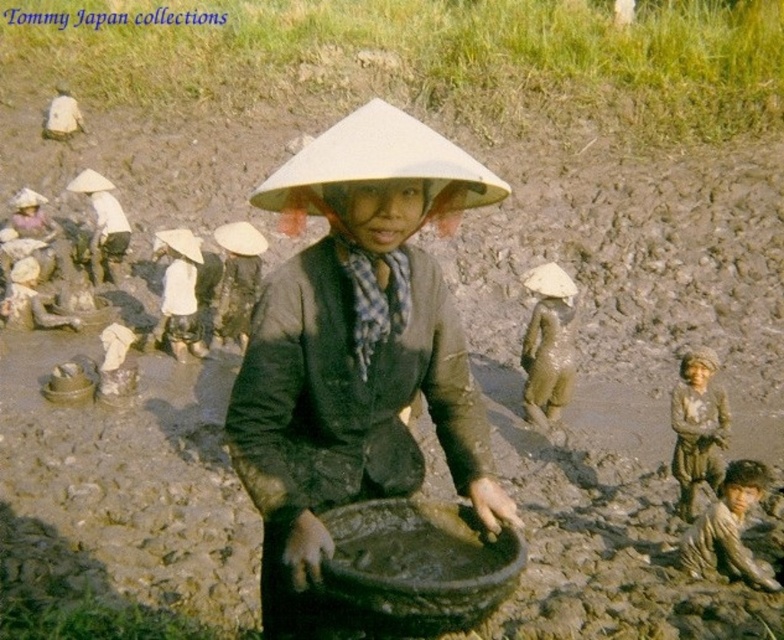
Is brown textured fabric at lower right to the right of matte black conical hat at center from the viewer's perspective?

Yes, brown textured fabric at lower right is to the right of matte black conical hat at center.

Which is below, brown textured fabric at lower right or matte black conical hat at center?

Positioned lower is brown textured fabric at lower right.

Which is behind, point (681, 358) or point (224, 292)?

The point (681, 358) is behind.

The height and width of the screenshot is (640, 784). I want to click on brown textured fabric at lower right, so click(x=697, y=426).

Is dirty brown skin at lower right below matte black conical hat at center?

Yes, dirty brown skin at lower right is below matte black conical hat at center.

How distant is dirty brown skin at lower right from matte black conical hat at center?

They are 4.19 meters apart.

Locate an element on the screen. dirty brown skin at lower right is located at coordinates (728, 529).

Find the location of a particular element. dirty brown skin at lower right is located at coordinates click(x=728, y=529).

From the picture: Does white fabric hat at center appear under white fabric hat at upper left?

Yes, white fabric hat at center is below white fabric hat at upper left.

Between white fabric hat at center and white fabric hat at upper left, which one has more height?

white fabric hat at center

What do you see at coordinates (178, 296) in the screenshot? I see `white fabric hat at center` at bounding box center [178, 296].

The height and width of the screenshot is (640, 784). I want to click on white fabric hat at center, so click(178, 296).